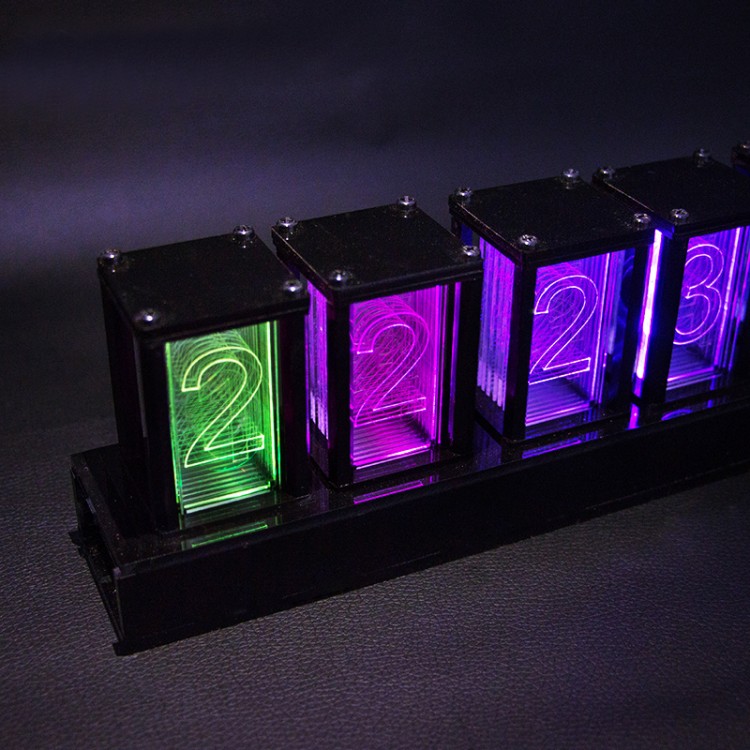
Find the location of a particular element. purple light is located at coordinates (570, 345), (692, 354).